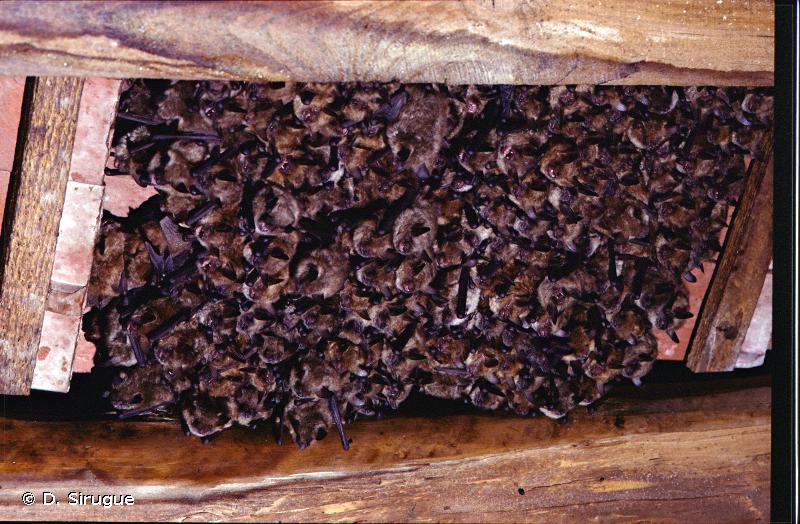
Where is `wood plank`? Image resolution: width=800 pixels, height=524 pixels. wood plank is located at coordinates (674, 352).